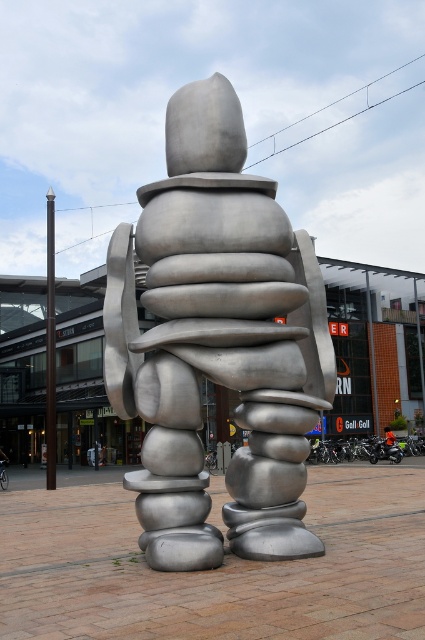
Question: Can you confirm if brushed metal mall at center is smaller than orange fabric jacket at center?

Choices:
 (A) no
 (B) yes

Answer: (A)

Question: Can you confirm if brushed metal sculpture at center is wider than orange fabric jacket at center?

Choices:
 (A) no
 (B) yes

Answer: (B)

Question: Can you confirm if brushed metal mall at center is positioned below orange fabric jacket at center?

Choices:
 (A) no
 (B) yes

Answer: (A)

Question: Estimate the real-world distances between objects in this image. Which object is farther from the brushed metal sculpture at center?

Choices:
 (A) orange fabric jacket at center
 (B) brushed metal mall at center

Answer: (A)

Question: Which point is farther to the camera?

Choices:
 (A) brushed metal sculpture at center
 (B) orange fabric jacket at center
 (C) brushed metal mall at center

Answer: (B)

Question: Which object is positioned closest to the brushed metal mall at center?

Choices:
 (A) brushed metal sculpture at center
 (B) orange fabric jacket at center

Answer: (A)